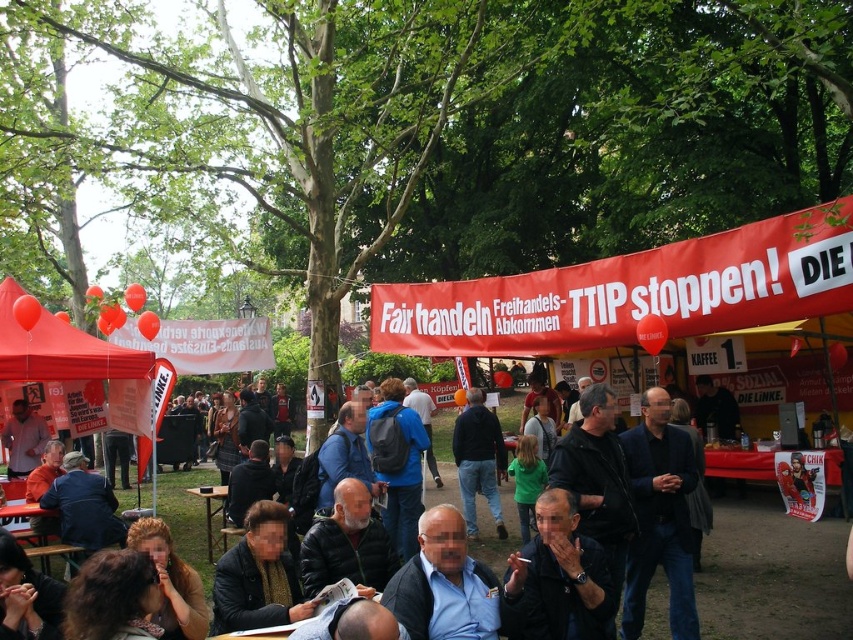
You are standing at the red banner stall on the right side of the image. You need to walk to a specific location marked by point (15, 285). However, there is an obstacle at point (445, 598). Will you encounter this obstacle before reaching your destination?

Yes, you will encounter the obstacle at point (445, 598) before reaching point (15, 285) because point (445, 598) is in front of point (15, 285) according to the spatial arrangement.

You are attending a park event and see a dark blue suit at center and a matte red canopy at left. Which object takes up more space in the image?

The matte red canopy at left takes up more space in the image because it is larger than the dark blue suit at center.